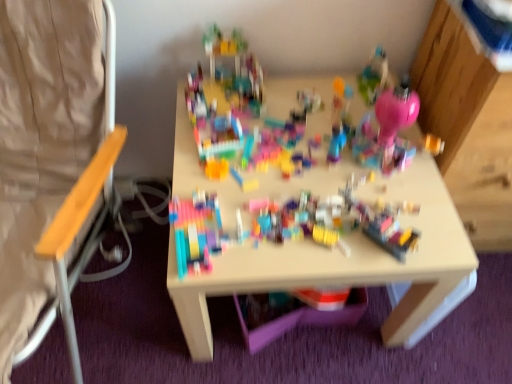
Question: From the image's perspective, is translucent plastic container at center, which is the 2th toy in top-to-bottom order, positioned above or below multicolored plastic blocks at center, the 1th toy positioned from the top?

Choices:
 (A) below
 (B) above

Answer: (A)

Question: Considering their positions, is translucent plastic container at center, the first toy when ordered from bottom to top, located in front of or behind multicolored plastic blocks at center, the 2th toy positioned from the right?

Choices:
 (A) behind
 (B) front

Answer: (A)

Question: Which is farther from the multicolored plastic blocks at center, which is the 2th toy from bottom to top?

Choices:
 (A) wooden seat at left
 (B) translucent plastic container at center, which is counted as the 1th toy, starting from the back

Answer: (A)

Question: Which object is the closest to the multicolored plastic blocks at center, which is the 2th toy from bottom to top?

Choices:
 (A) translucent plastic container at center, which is the 2th toy in top-to-bottom order
 (B) wooden seat at left

Answer: (A)